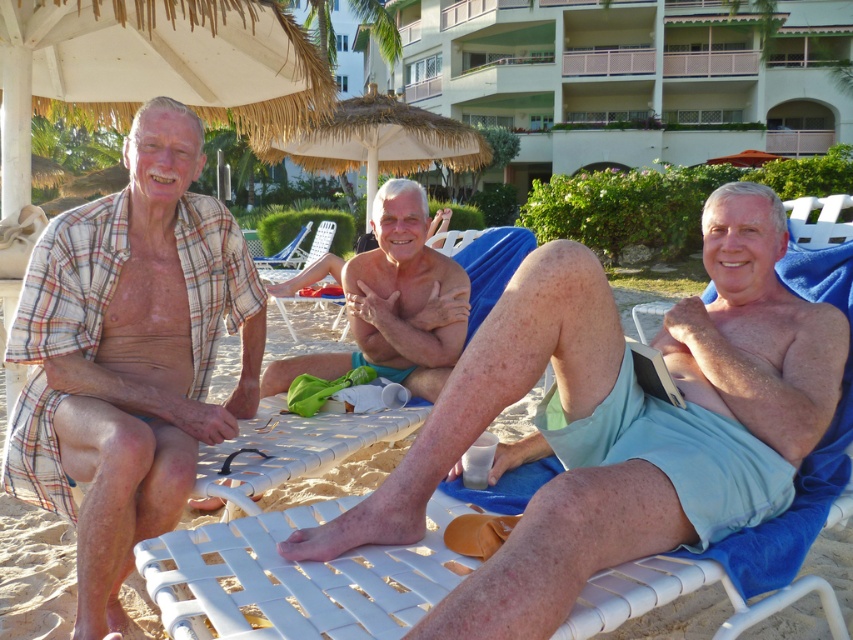
Question: Does white matte skin at center have a greater width compared to thatched straw umbrella at center?

Choices:
 (A) yes
 (B) no

Answer: (B)

Question: Is white matte skin at center wider than white plastic beach chair at center?

Choices:
 (A) yes
 (B) no

Answer: (A)

Question: Among these objects, which one is farthest from the camera?

Choices:
 (A) white matte skin at center
 (B) light blue fabric shorts at center
 (C) white plastic beach chair at center
 (D) thatched straw umbrella at center

Answer: (C)

Question: Which of the following is the closest to the observer?

Choices:
 (A) (532, 355)
 (B) (352, 138)
 (C) (173, 490)
 (D) (297, 237)

Answer: (A)

Question: Which point is farther to the camera?

Choices:
 (A) (210, 291)
 (B) (346, 134)
 (C) (749, 307)

Answer: (B)

Question: Can you confirm if white matte skin at center is wider than white plastic beach chair at center?

Choices:
 (A) yes
 (B) no

Answer: (A)